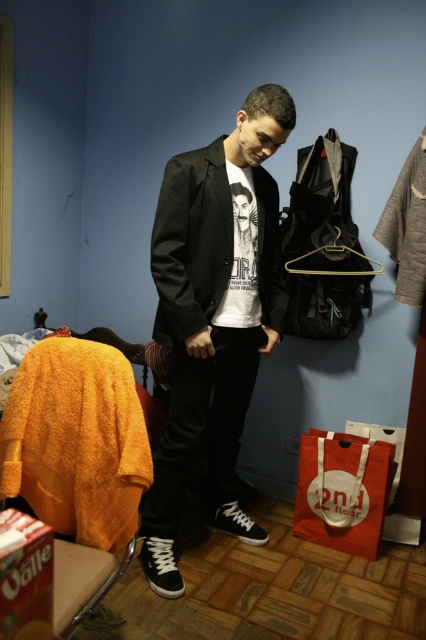
Between orange fuzzy sweater at left and matte black jacket at center, which one is positioned lower?

orange fuzzy sweater at left is lower down.

In the scene shown: Who is higher up, orange fuzzy sweater at left or matte black jacket at center?

matte black jacket at center is higher up.

At what (x,y) coordinates should I click in order to perform the action: click on orange fuzzy sweater at left. Please return your answer as a coordinate pair (x, y). The image size is (426, 640). Looking at the image, I should click on (77, 440).

Can you confirm if matte black sneakers at lower left is thinner than orange fuzzy sweater at left?

No.

Can you confirm if matte black sneakers at lower left is wider than orange fuzzy sweater at left?

Yes.

Measure the distance between point (x=154, y=266) and camera.

Point (x=154, y=266) and camera are 1.85 meters apart from each other.

I want to click on matte black sneakers at lower left, so click(x=213, y=317).

Who is higher up, matte black sneakers at lower left or matte black jacket at center?

Positioned higher is matte black jacket at center.

Is point (247, 266) farther from viewer compared to point (201, 157)?

Yes, point (247, 266) is farther from viewer.

You are a GUI agent. You are given a task and a screenshot of the screen. Output one action in this format:
    pyautogui.click(x=<x>, y=<y>)
    Task: Click on the matte black sneakers at lower left
    The height and width of the screenshot is (640, 426).
    Given the screenshot: What is the action you would take?
    pyautogui.click(x=213, y=317)